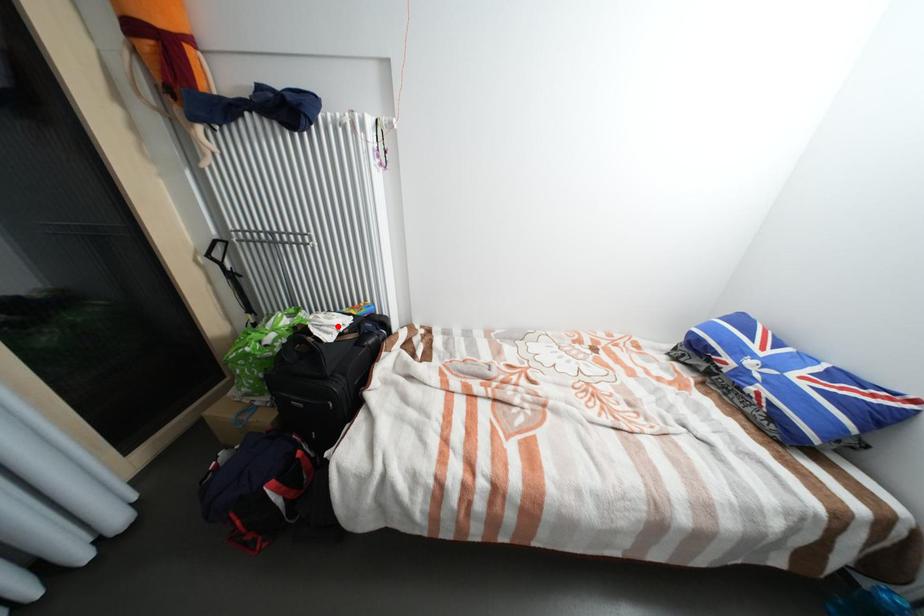
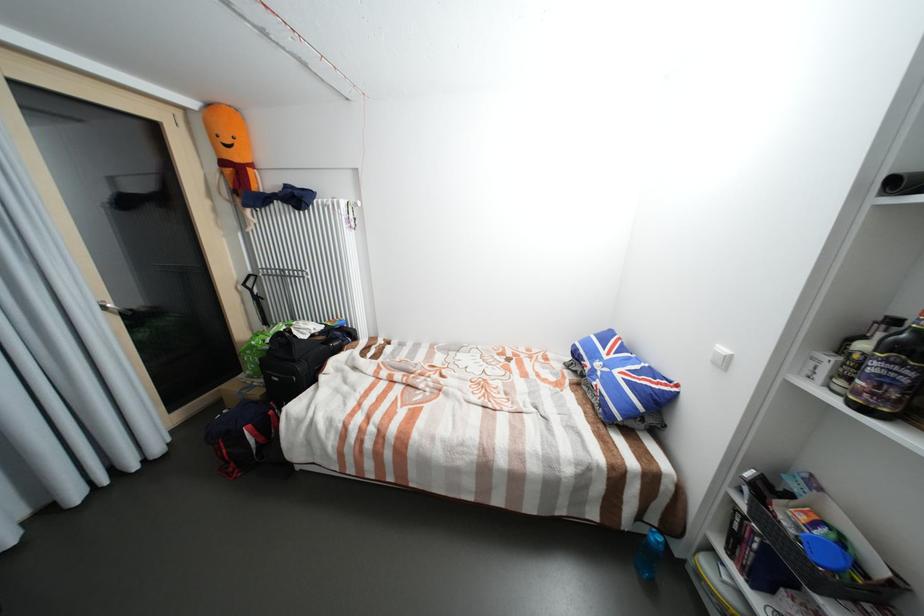
Locate, in the second image, the point that corresponds to the highlighted location in the first image.

(313, 330)